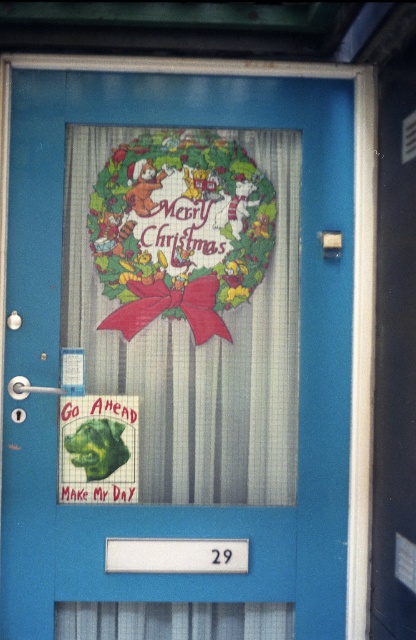
You are a delivery person who needs to place a package between the decorative paper wreath at center and the green matte sign at lower left. The package is 30 centimeters long. Can you fit it in the space between them?

The space between the decorative paper wreath at center and the green matte sign at lower left is 40.53 centimeters. Since the package is 30 centimeters long, it can fit in the space between them.

From the picture: You are a delivery person trying to read the message on the green matte sign at lower left. However, you notice the decorative paper wreath at center is blocking your view. Based on the scene, can you estimate whether the wreath is taller than the sign?

The decorative paper wreath at center is much taller than the green matte sign at lower left, so it is likely blocking the view of the sign.